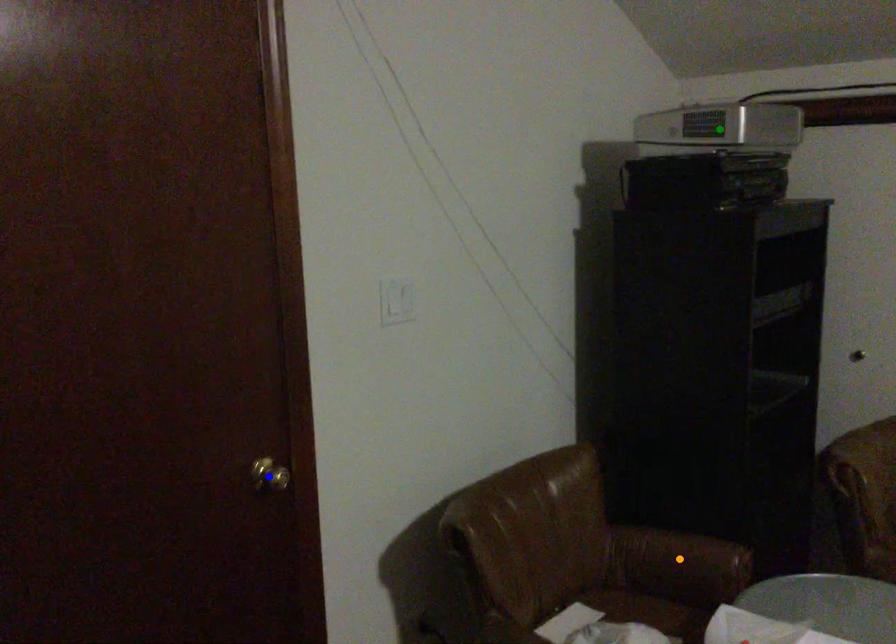
Order these from nearest to farthest:
blue point, orange point, green point

blue point → orange point → green point